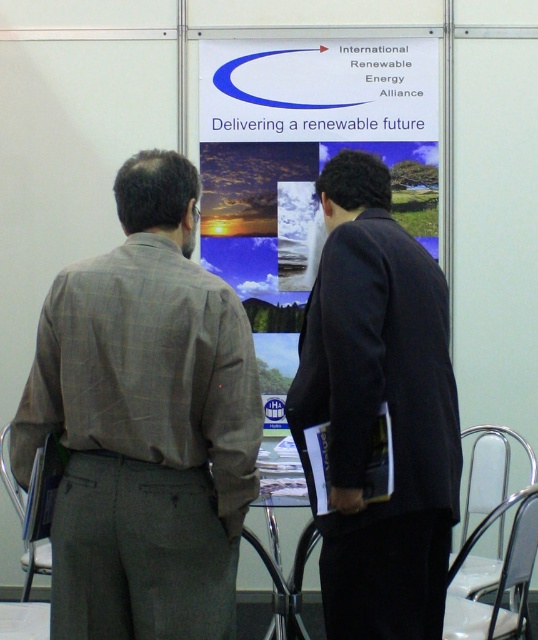
You are planning to place a new decorative plant pot in front of the white paperboard at center. However, you need to ensure that the metallic silver chair at lower left won

The metallic silver chair at lower left is behind the white paperboard at center, so placing the plant pot in front of the white paperboard at center would not block the chair.

You are a visitor at an exhibition and need to move from your current position to the metallic silver chair at lower right. The path is clear except for the white paperboard at center. Can you walk around it without touching the board?

The distance between the white paperboard at center and metallic silver chair at lower right is 5.96 feet. Since the path is clear except for the board, you can walk around the white paperboard at center to reach the chair as long as you maintain a safe distance from the board.

You are an event planner setting up a conference room. You have a white paperboard at center and a metallic silver chair at lower left. You need to place a 1.2 meter wide banner horizontally between them. Can the banner fit between the two objects?

The white paperboard at center is wider than the metallic silver chair at lower left. However, the exact distance between them isn generated in the description. Without knowing the distance between the white paperboard at center and the metallic silver chair at lower left, it is impossible to determine if the banner will fit.